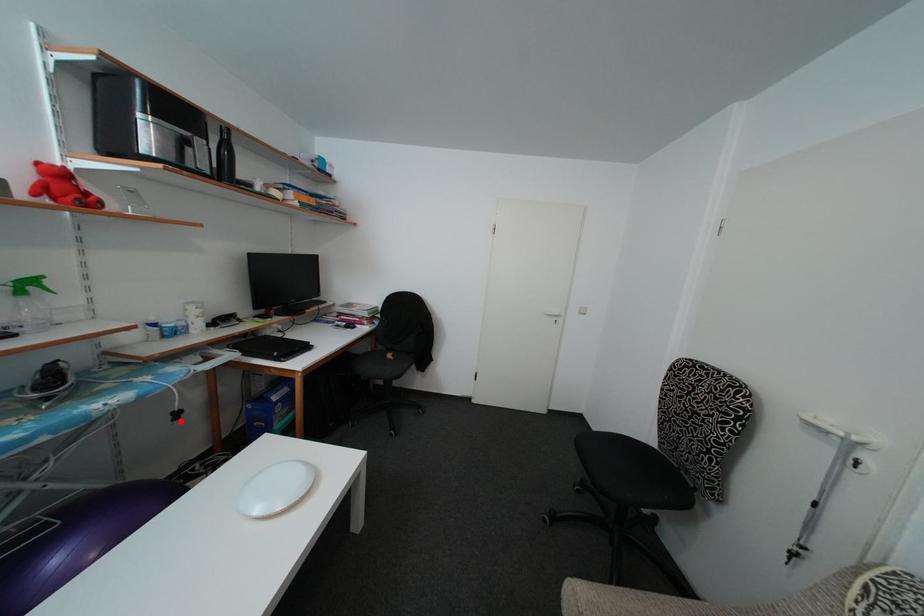
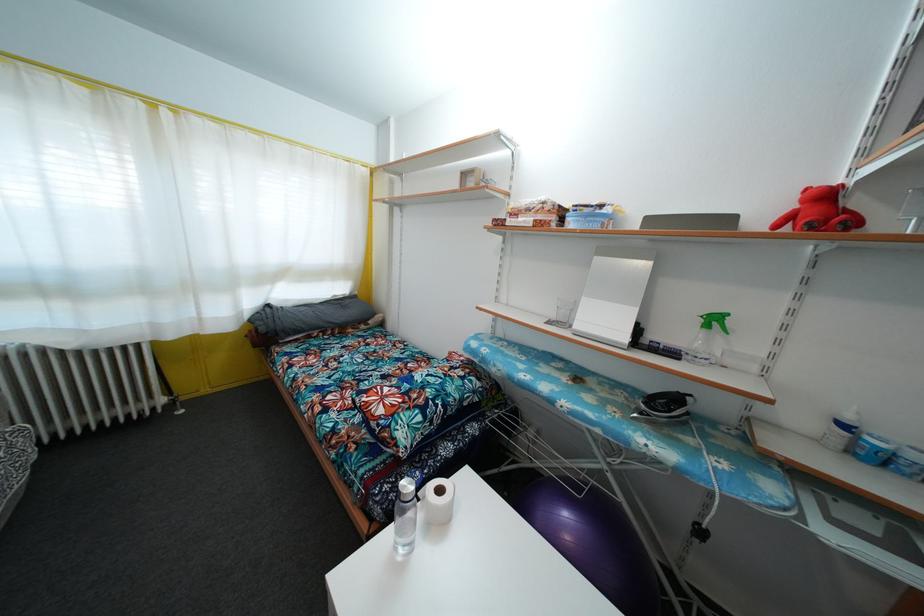
Where in the second image is the point corresponding to the highlighted location from the first image?

(704, 540)